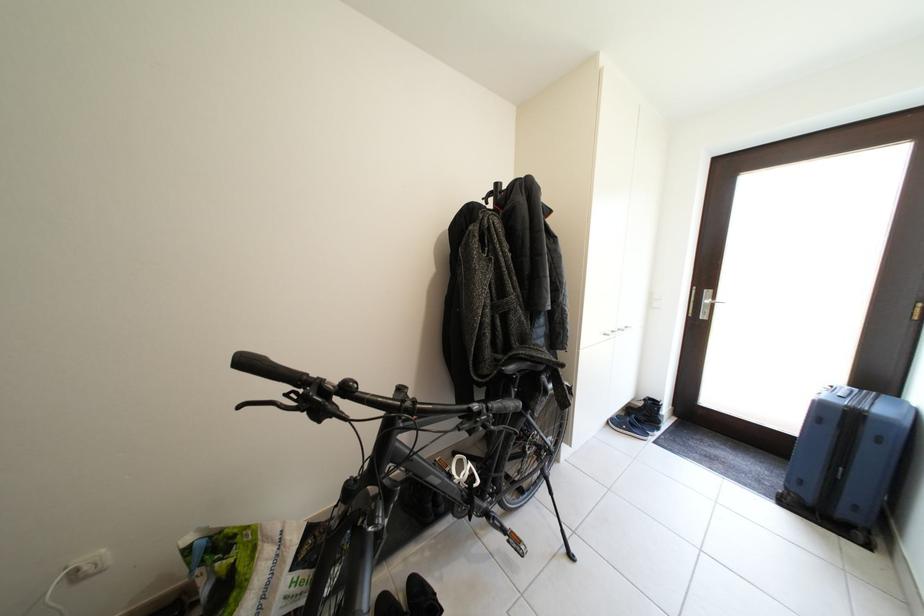
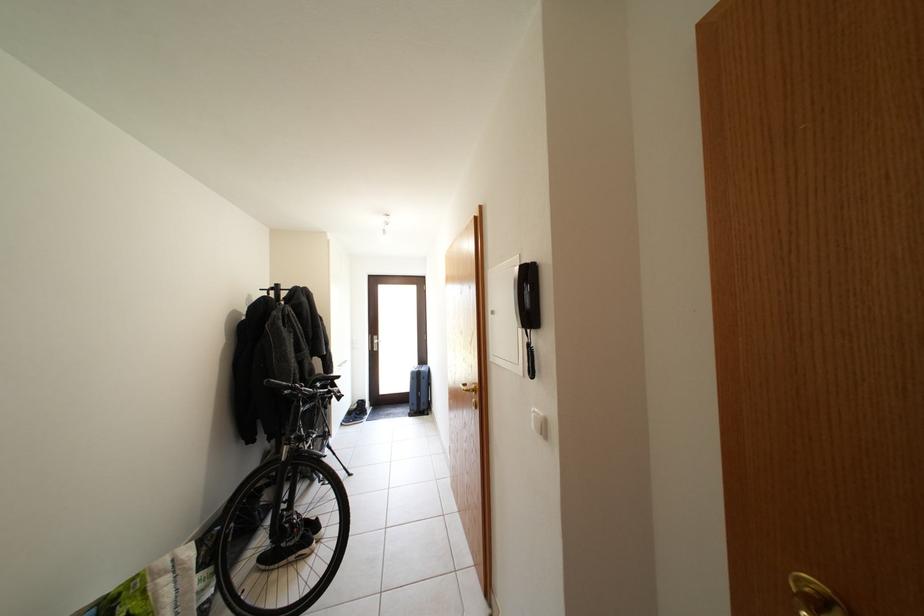
Find the pixel in the second image that matches (497,199) in the first image.

(281, 294)